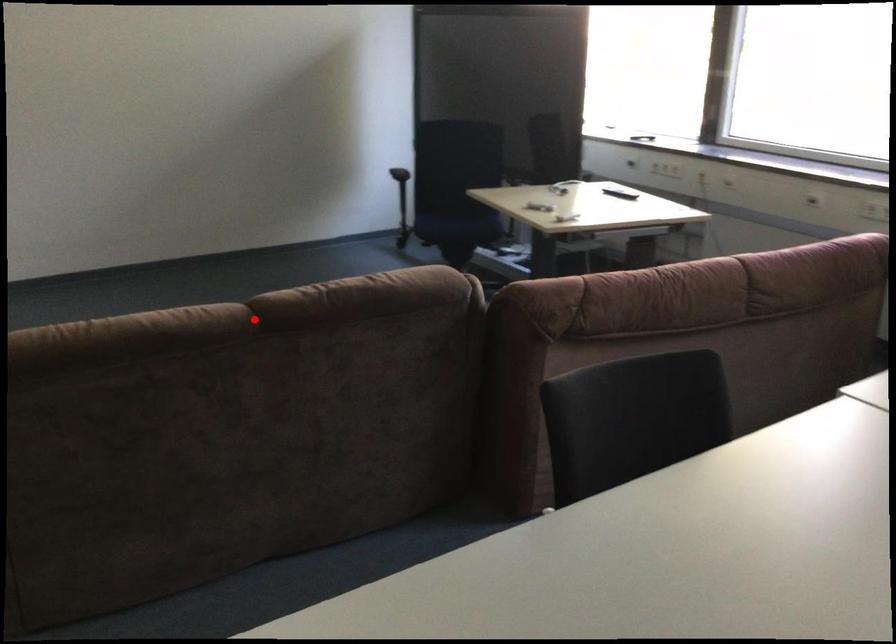
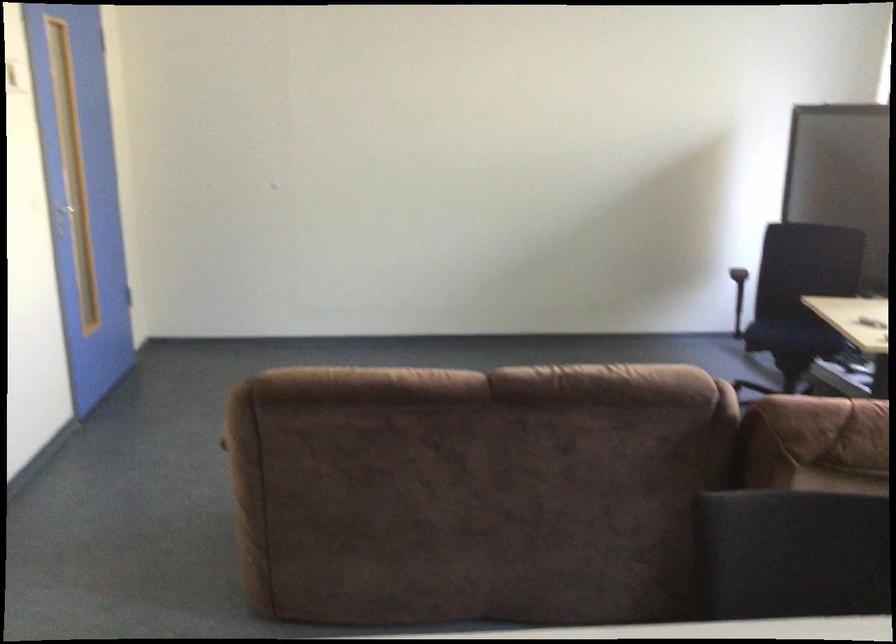
Where in the second image is the point corresponding to the highlighted location from the first image?

(487, 386)